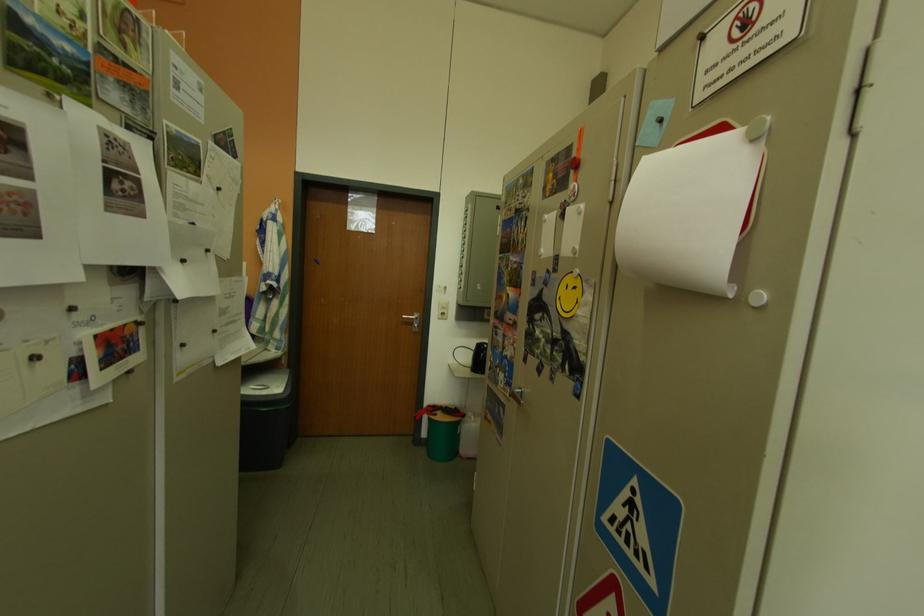
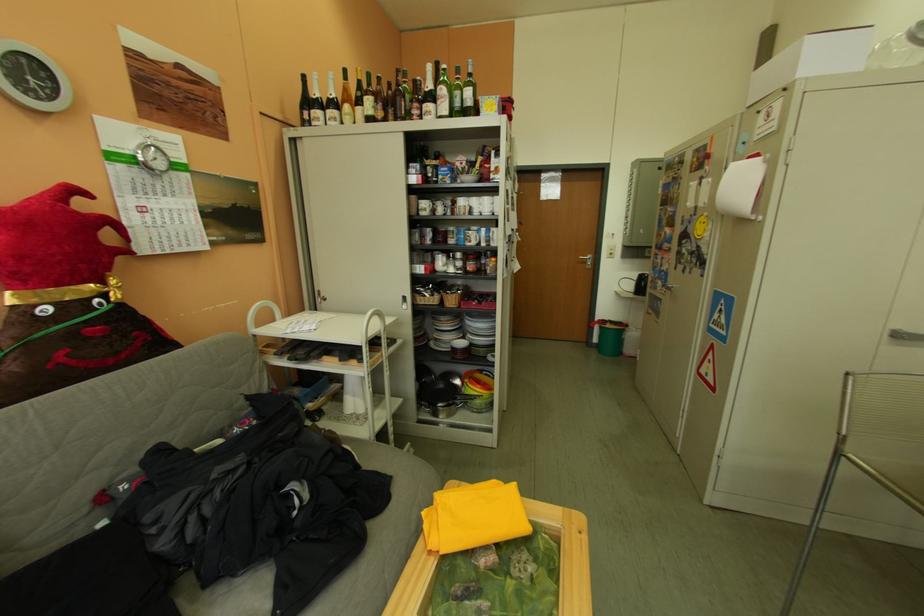
The point at (448, 416) is marked in the first image. Where is the corresponding point in the second image?

(617, 326)